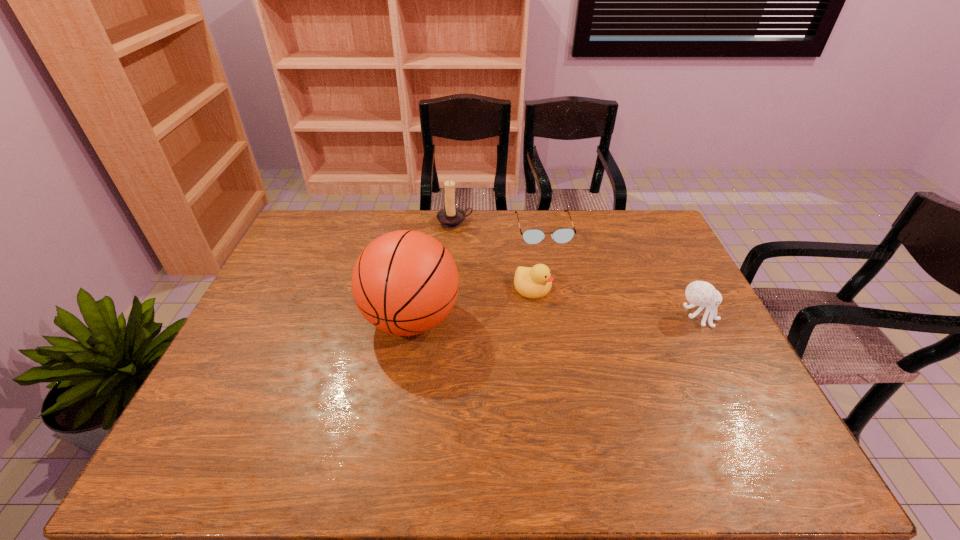
The width and height of the screenshot is (960, 540). I want to click on free space between the duckling and the fourth shortest object, so click(493, 255).

Identify the location of object that stands as the second closest to the rightmost object. The width and height of the screenshot is (960, 540). (531, 236).

The width and height of the screenshot is (960, 540). What are the coordinates of `object that is the third closest one to the duckling` in the screenshot? It's located at (450, 217).